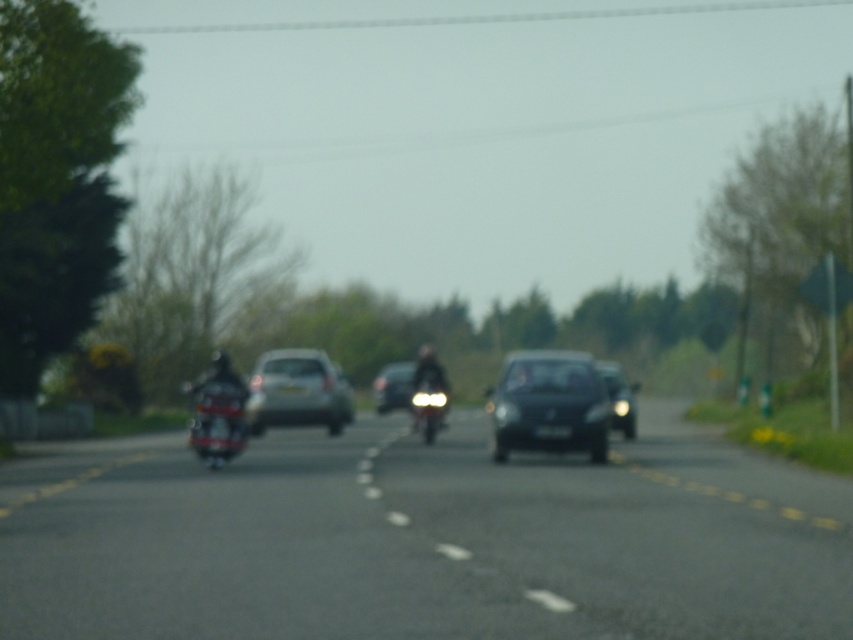
You are a pedestrian standing at the edge of the road. You see a silver metallic hatchback at center and a matte black car at center. Which vehicle is positioned higher in the image?

The silver metallic hatchback at center is located above the matte black car at center in the image.

Consider the image. You are a pedestrian standing at the side of the road. You see a silver metallic hatchback at center and a black glossy van at center. Which vehicle is closer to the left edge of the road?

The silver metallic hatchback at center is closer to the left edge of the road because it is positioned to the left of the black glossy van at center.

You are a driver approaching the road and want to determine the distance between two points on the road. The first point is at coordinates point (260, 390) and the second is at point (407, 394). Based on the scene description, which point is closer to your current position?

Point (260, 390) is closer to the camera than point (407, 394), so the first point is closer to your current position.